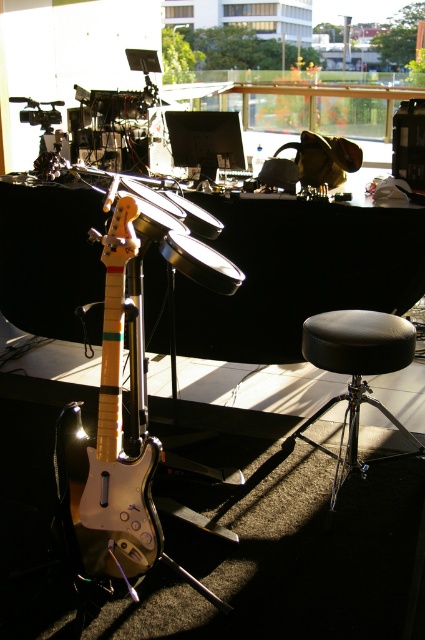
Does glossy wood guitar at center have a smaller size compared to black leather stool at lower right?

Indeed, glossy wood guitar at center has a smaller size compared to black leather stool at lower right.

Measure the distance from glossy wood guitar at center to black leather stool at lower right.

34.09 inches

Between point (93, 564) and point (354, 387), which one is positioned behind?

The point (354, 387) is more distant.

At what (x,y) coordinates should I click in order to perform the action: click on glossy wood guitar at center. Please return your answer as a coordinate pair (x, y). The height and width of the screenshot is (640, 425). Looking at the image, I should click on (116, 436).